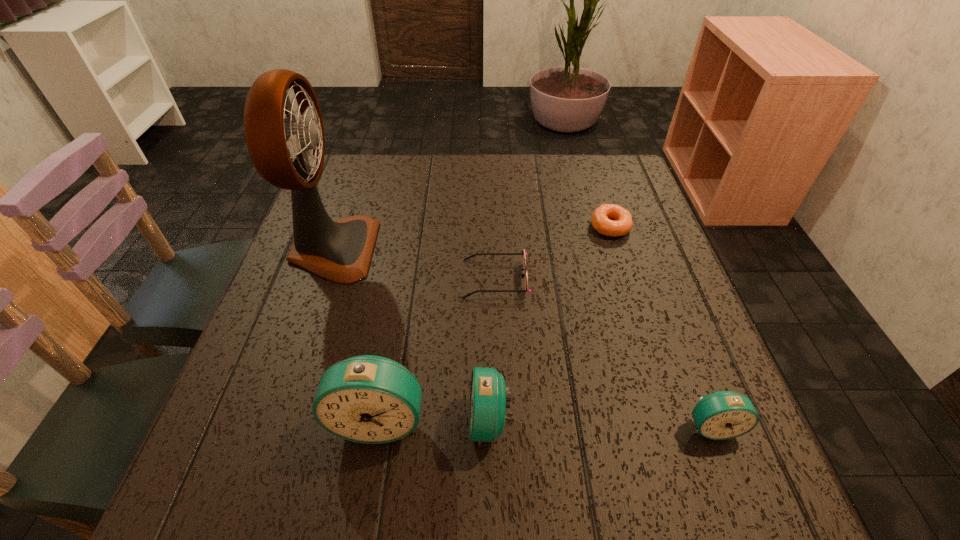
Find the location of a particular element. The image size is (960, 540). the second tallest object is located at coordinates (368, 399).

Find the location of a particular element. the leftmost alarm clock is located at coordinates (368, 399).

This screenshot has height=540, width=960. Find the location of `the third tallest object`. the third tallest object is located at coordinates coord(487,402).

Identify the location of the second shortest alarm clock. (487, 402).

Where is `the shortest alarm clock`? This screenshot has height=540, width=960. the shortest alarm clock is located at coordinates (722, 415).

Image resolution: width=960 pixels, height=540 pixels. Find the location of `the third shortest object`. the third shortest object is located at coordinates (722, 415).

Identify the location of sunglasses. (523, 253).

Where is `the tallest object`? The height and width of the screenshot is (540, 960). the tallest object is located at coordinates (289, 154).

The height and width of the screenshot is (540, 960). I want to click on the leftmost object, so click(x=289, y=154).

Find the location of a particular element. The width and height of the screenshot is (960, 540). doughnut is located at coordinates (621, 224).